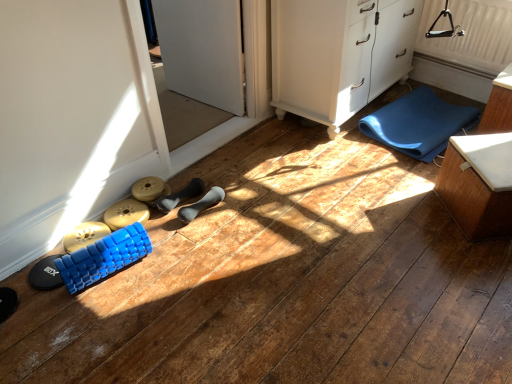
Question: Is black fuzzy slipper at lower left, placed as the 4th footwear when sorted from right to left, positioned behind white textured box at right?

Choices:
 (A) yes
 (B) no

Answer: (B)

Question: From a real-world perspective, is black fuzzy slipper at lower left, arranged as the first footwear when viewed from the left, on white textured box at right?

Choices:
 (A) no
 (B) yes

Answer: (A)

Question: Is black fuzzy slipper at lower left, arranged as the first footwear when viewed from the left, next to white textured box at right and touching it?

Choices:
 (A) no
 (B) yes

Answer: (A)

Question: Is black fuzzy slipper at lower left, arranged as the first footwear when viewed from the left, located outside white textured box at right?

Choices:
 (A) yes
 (B) no

Answer: (A)

Question: Is black fuzzy slipper at lower left, arranged as the first footwear when viewed from the left, to the left of white textured box at right from the viewer's perspective?

Choices:
 (A) no
 (B) yes

Answer: (B)

Question: Would you consider black fuzzy slipper at lower left, arranged as the first footwear when viewed from the left, to be distant from white textured box at right?

Choices:
 (A) no
 (B) yes

Answer: (B)

Question: From a real-world perspective, is blue foam roller at lower left, the 2th toy when ordered from back to front, located higher than blue rubber yoga mat at lower right?

Choices:
 (A) yes
 (B) no

Answer: (A)

Question: Is blue foam roller at lower left, which ranks as the 1th toy in front-to-back order, wider than blue rubber yoga mat at lower right?

Choices:
 (A) yes
 (B) no

Answer: (B)

Question: From the image's perspective, would you say blue foam roller at lower left, the 2th toy when ordered from back to front, is shown under blue rubber yoga mat at lower right?

Choices:
 (A) yes
 (B) no

Answer: (A)

Question: Is blue rubber yoga mat at lower right at the back of blue foam roller at lower left, which ranks as the 1th toy in front-to-back order?

Choices:
 (A) no
 (B) yes

Answer: (A)

Question: Does blue foam roller at lower left, which ranks as the 1th toy in front-to-back order, have a smaller size compared to blue rubber yoga mat at lower right?

Choices:
 (A) no
 (B) yes

Answer: (B)

Question: Can you confirm if blue foam roller at lower left, the 2th toy when ordered from back to front, is shorter than blue rubber yoga mat at lower right?

Choices:
 (A) yes
 (B) no

Answer: (B)

Question: Is blue textured foam roller at lower left, the third footwear in the right-to-left sequence, far from blue textured foam roller at lower left, which ranks as the second toy in front-to-back order?

Choices:
 (A) yes
 (B) no

Answer: (B)